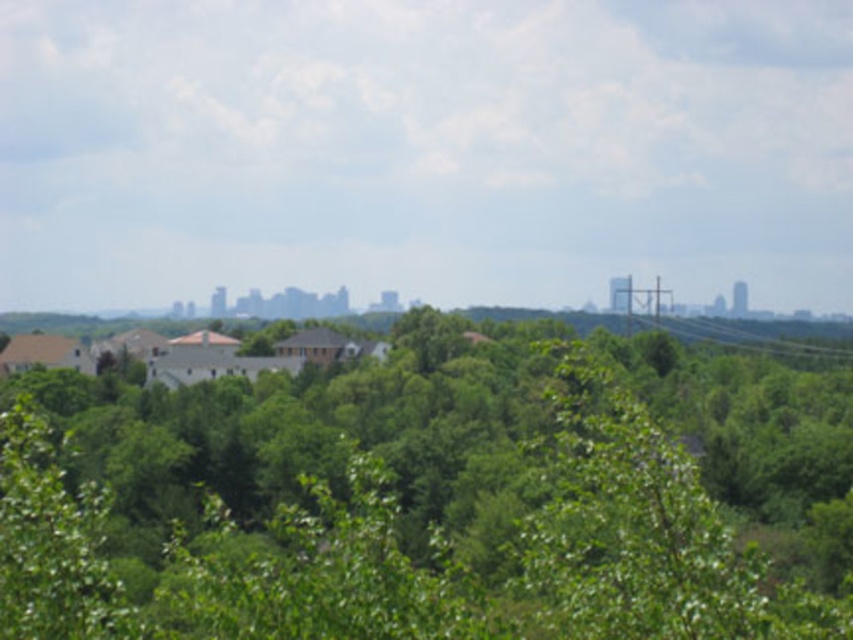
Does green leafy tree at center appear on the left side of metallic wire at right?

Indeed, green leafy tree at center is positioned on the left side of metallic wire at right.

Between point (563, 460) and point (759, 346), which one is positioned behind?

Point (759, 346)

Between point (405, 326) and point (843, 355), which one is positioned behind?

Positioned behind is point (843, 355).

Image resolution: width=853 pixels, height=640 pixels. What are the coordinates of `green leafy tree at center` in the screenshot? It's located at (428, 497).